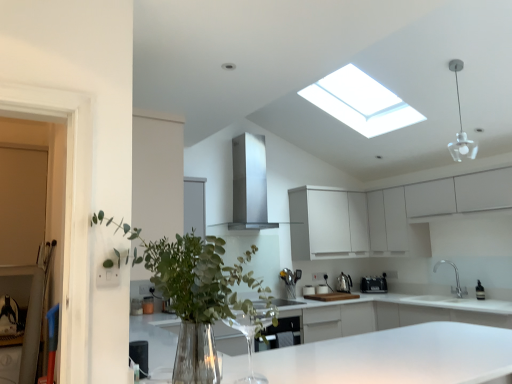
Question: Does green leafy plant at center contain white glossy countertop at center?

Choices:
 (A) yes
 (B) no

Answer: (B)

Question: Is green leafy plant at center closer to the viewer compared to white glossy countertop at center?

Choices:
 (A) yes
 (B) no

Answer: (B)

Question: Considering the relative sizes of green leafy plant at center and white glossy countertop at center in the image provided, is green leafy plant at center thinner than white glossy countertop at center?

Choices:
 (A) yes
 (B) no

Answer: (A)

Question: Is green leafy plant at center facing towards white glossy countertop at center?

Choices:
 (A) no
 (B) yes

Answer: (A)

Question: Can you confirm if green leafy plant at center is bigger than white glossy countertop at center?

Choices:
 (A) no
 (B) yes

Answer: (A)

Question: From the image's perspective, is green leafy plant at center on white glossy countertop at center?

Choices:
 (A) yes
 (B) no

Answer: (A)

Question: Can you confirm if white glossy countertop at center is taller than white matte cabinetry at upper right, marked as the second cabinetry in a back-to-front arrangement?

Choices:
 (A) no
 (B) yes

Answer: (B)

Question: Does white glossy countertop at center come in front of white matte cabinetry at upper right, which is counted as the first cabinetry, starting from the front?

Choices:
 (A) yes
 (B) no

Answer: (A)

Question: From a real-world perspective, is white glossy countertop at center over white matte cabinetry at upper right, which is counted as the first cabinetry, starting from the front?

Choices:
 (A) yes
 (B) no

Answer: (B)

Question: Is white glossy countertop at center wider than white matte cabinetry at upper right, marked as the second cabinetry in a back-to-front arrangement?

Choices:
 (A) yes
 (B) no

Answer: (A)

Question: From the image's perspective, would you say white glossy countertop at center is shown under white matte cabinetry at upper right, marked as the second cabinetry in a back-to-front arrangement?

Choices:
 (A) yes
 (B) no

Answer: (A)

Question: From the image's perspective, is white glossy countertop at center on white matte cabinetry at upper right, marked as the second cabinetry in a back-to-front arrangement?

Choices:
 (A) no
 (B) yes

Answer: (A)

Question: Considering the relative positions of white glass pendant light at upper right and white glossy countertop at center in the image provided, is white glass pendant light at upper right in front of white glossy countertop at center?

Choices:
 (A) no
 (B) yes

Answer: (A)